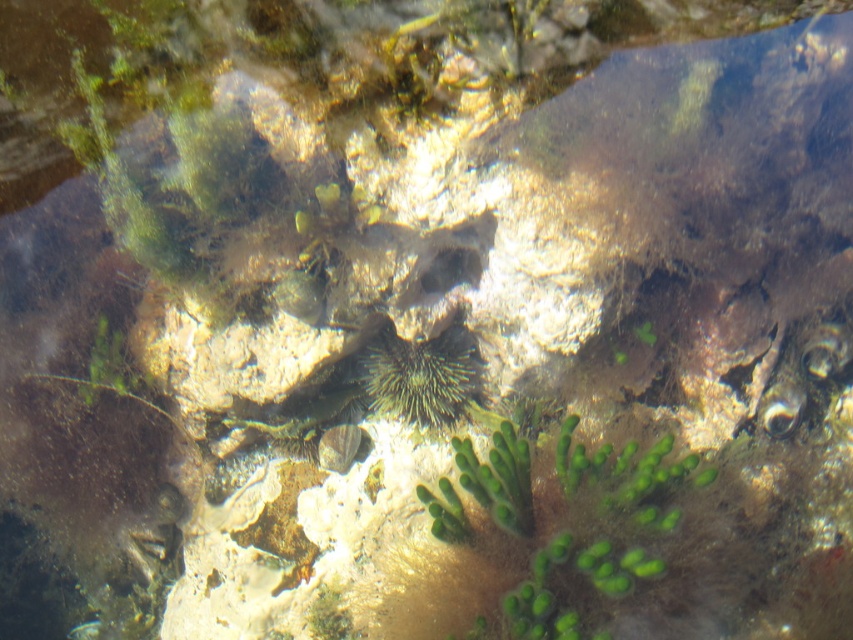
Does green fuzzy algae at center appear under green spiny at center?

Yes, green fuzzy algae at center is below green spiny at center.

Which is behind, point (434, 605) or point (448, 365)?

Point (448, 365)

The width and height of the screenshot is (853, 640). Find the location of `green fuzzy algae at center`. green fuzzy algae at center is located at coordinates (534, 540).